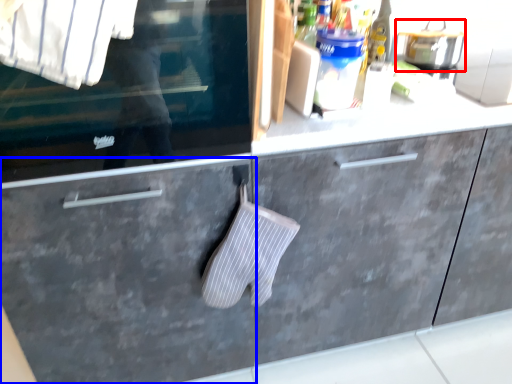
Question: Which of the following is the farthest to the observer, appliance (highlighted by a red box) or drawer (highlighted by a blue box)?

Choices:
 (A) appliance
 (B) drawer

Answer: (A)